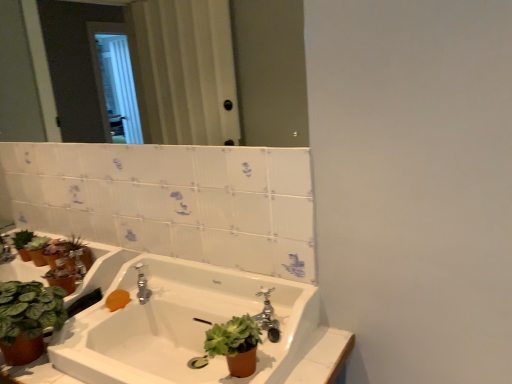
Question: Does orange matte soap at lower left appear on the left side of clear glass mirror at upper center?

Choices:
 (A) yes
 (B) no

Answer: (B)

Question: From the image's perspective, is orange matte soap at lower left located above clear glass mirror at upper center?

Choices:
 (A) yes
 (B) no

Answer: (B)

Question: Can you confirm if orange matte soap at lower left is taller than clear glass mirror at upper center?

Choices:
 (A) yes
 (B) no

Answer: (B)

Question: Can you confirm if orange matte soap at lower left is positioned to the right of clear glass mirror at upper center?

Choices:
 (A) yes
 (B) no

Answer: (A)

Question: Is orange matte soap at lower left shorter than clear glass mirror at upper center?

Choices:
 (A) no
 (B) yes

Answer: (B)

Question: Looking at their shapes, would you say white glossy sink at center is wider or thinner than orange matte soap at lower left?

Choices:
 (A) wide
 (B) thin

Answer: (A)

Question: Looking at the image, does white glossy sink at center seem bigger or smaller compared to orange matte soap at lower left?

Choices:
 (A) big
 (B) small

Answer: (A)

Question: Considering the positions of white glossy sink at center and orange matte soap at lower left in the image, is white glossy sink at center taller or shorter than orange matte soap at lower left?

Choices:
 (A) tall
 (B) short

Answer: (A)

Question: Considering the relative positions of white glossy sink at center and orange matte soap at lower left in the image provided, is white glossy sink at center to the left or to the right of orange matte soap at lower left?

Choices:
 (A) left
 (B) right

Answer: (B)

Question: From the image's perspective, is clear glass mirror at upper center located above or below silver metallic faucet at center?

Choices:
 (A) above
 (B) below

Answer: (A)

Question: From their relative heights in the image, would you say clear glass mirror at upper center is taller or shorter than silver metallic faucet at center?

Choices:
 (A) short
 (B) tall

Answer: (B)

Question: Looking at their shapes, would you say clear glass mirror at upper center is wider or thinner than silver metallic faucet at center?

Choices:
 (A) wide
 (B) thin

Answer: (B)

Question: From a real-world perspective, relative to silver metallic faucet at center, is clear glass mirror at upper center vertically above or below?

Choices:
 (A) above
 (B) below

Answer: (A)

Question: In terms of size, does silver metallic faucet at center appear bigger or smaller than clear glass mirror at upper center?

Choices:
 (A) big
 (B) small

Answer: (B)

Question: Does point (139, 268) appear closer or farther from the camera than point (27, 114)?

Choices:
 (A) farther
 (B) closer

Answer: (B)